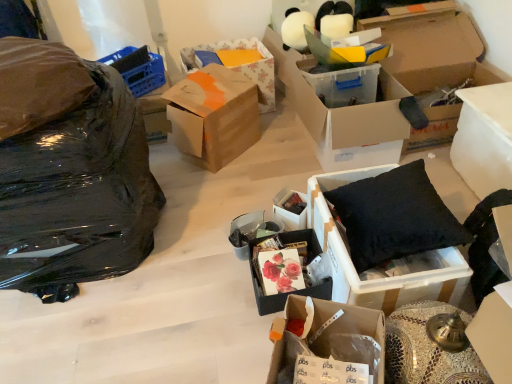
Locate an element on the screen. The width and height of the screenshot is (512, 384). free space that is in between black plastic bag at left and matte black box at center, the sixth box positioned from the right is located at coordinates (194, 224).